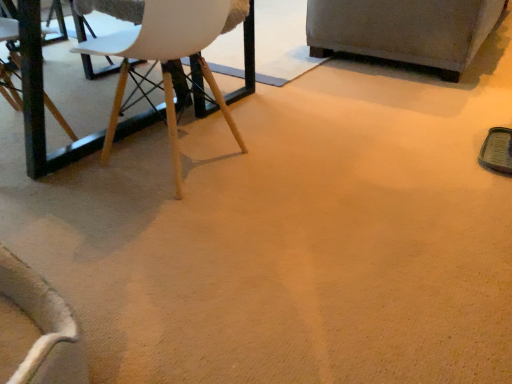
Question: Is velvet gray armchair at upper right positioned in front of white matte chair at upper left?

Choices:
 (A) yes
 (B) no

Answer: (B)

Question: Does velvet gray armchair at upper right have a lesser height compared to white matte chair at upper left?

Choices:
 (A) yes
 (B) no

Answer: (A)

Question: Is velvet gray armchair at upper right with white matte chair at upper left?

Choices:
 (A) yes
 (B) no

Answer: (B)

Question: From a real-world perspective, is velvet gray armchair at upper right on white matte chair at upper left?

Choices:
 (A) yes
 (B) no

Answer: (B)

Question: Can you confirm if velvet gray armchair at upper right is smaller than white matte chair at upper left?

Choices:
 (A) yes
 (B) no

Answer: (B)

Question: Can you confirm if velvet gray armchair at upper right is taller than white matte chair at upper left?

Choices:
 (A) yes
 (B) no

Answer: (B)

Question: Does white matte chair at upper left turn towards velvet gray armchair at upper right?

Choices:
 (A) yes
 (B) no

Answer: (B)

Question: From a real-world perspective, is white matte chair at upper left physically above velvet gray armchair at upper right?

Choices:
 (A) no
 (B) yes

Answer: (B)

Question: From the image's perspective, is white matte chair at upper left below velvet gray armchair at upper right?

Choices:
 (A) yes
 (B) no

Answer: (A)

Question: From a real-world perspective, is white matte chair at upper left physically below velvet gray armchair at upper right?

Choices:
 (A) yes
 (B) no

Answer: (B)

Question: Would you say white matte chair at upper left is outside velvet gray armchair at upper right?

Choices:
 (A) no
 (B) yes

Answer: (B)

Question: Does white matte chair at upper left have a lesser height compared to velvet gray armchair at upper right?

Choices:
 (A) no
 (B) yes

Answer: (A)

Question: Is velvet gray armchair at upper right in front of or behind white matte chair at upper left in the image?

Choices:
 (A) behind
 (B) front

Answer: (A)